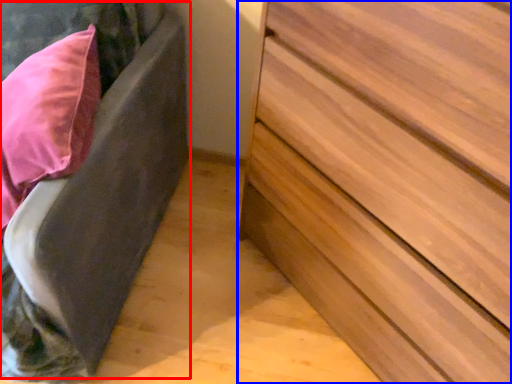
Question: Which object is closer to the camera taking this photo, bed frame (highlighted by a red box) or chest of drawers (highlighted by a blue box)?

Choices:
 (A) bed frame
 (B) chest of drawers

Answer: (B)